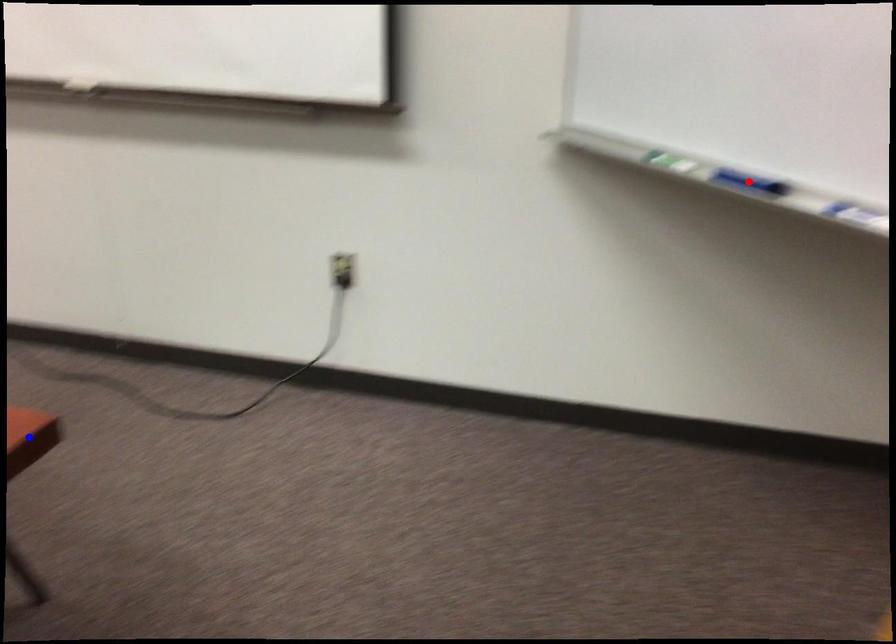
Question: Two points are marked on the image. Which point is closer to the camera?

Choices:
 (A) Blue point is closer.
 (B) Red point is closer.

Answer: (B)